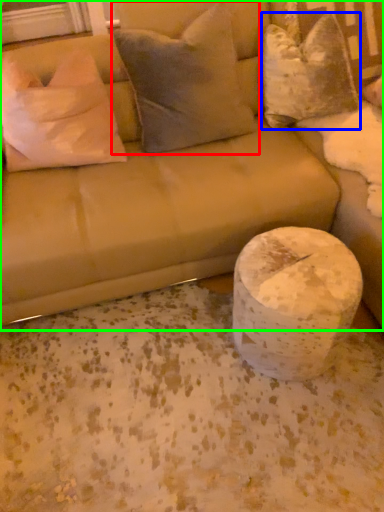
Question: Estimate the real-world distances between objects in this image. Which object is farther from pillow (highlighted by a red box), pillow (highlighted by a blue box) or studio couch (highlighted by a green box)?

Choices:
 (A) pillow
 (B) studio couch

Answer: (A)